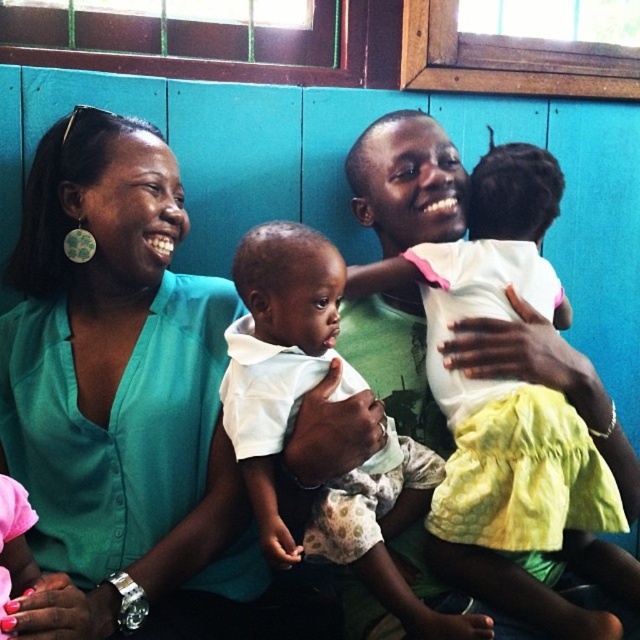
You are a photographer trying to capture a candid shot of the scene. You want to ensure the teal shirt at left and the white soft fabric baby at center are both in focus. Since you can only focus on one subject, which one should you choose to ensure the other is also in focus given their positions?

The teal shirt at left is to the left of white soft fabric baby at center, so if you focus on the white soft fabric baby at center, the teal shirt at left will also be in focus because it is closer to the camera.

You are a photographer setting up a shoot in this scene. You need to ensure that all clothing items are visible in the photo. The teal shirt at left and the white matte dress at center are two key items. Which clothing item requires you to adjust your camera angle to capture its full length without cropping?

The white matte dress at center requires adjusting the camera angle because it is taller than the teal shirt at left, so you need to ensure the camera captures its full length.